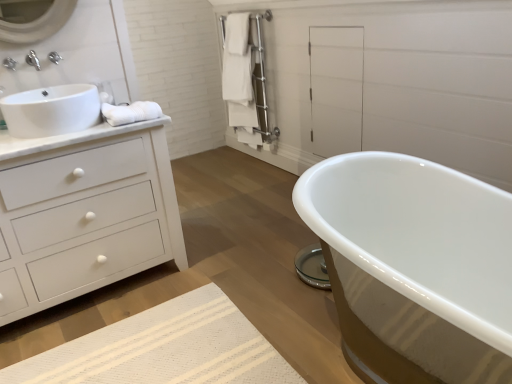
At what (x,y) coordinates should I click in order to perform the action: click on free space above satin nickel towel rack at upper center (from a real-world perspective). Please return your answer as a coordinate pair (x, y). Image resolution: width=512 pixels, height=384 pixels. Looking at the image, I should click on (245, 10).